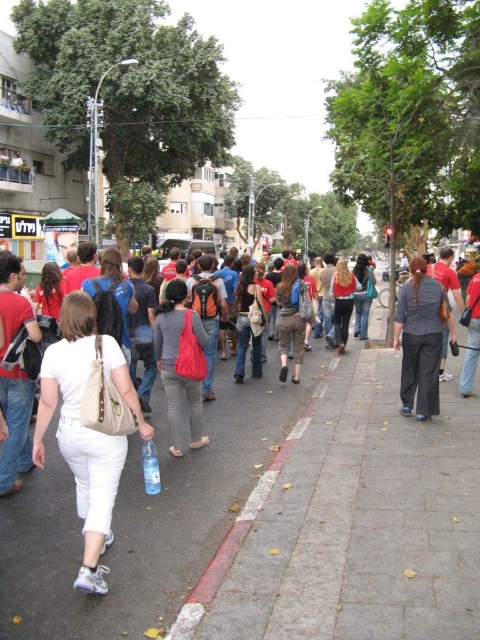
You are standing on the sidewalk and see two points marked on the ground. One is at point (140, 419) and the other is at point (180, 381). Which point is closer to you?

Point (140, 419) is closer to the viewer than point (180, 381).